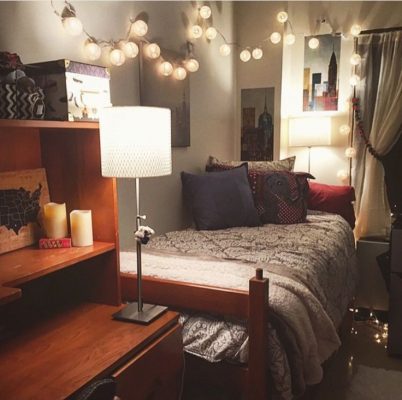
Where is `wall`? This screenshot has width=402, height=400. wall is located at coordinates (222, 110).